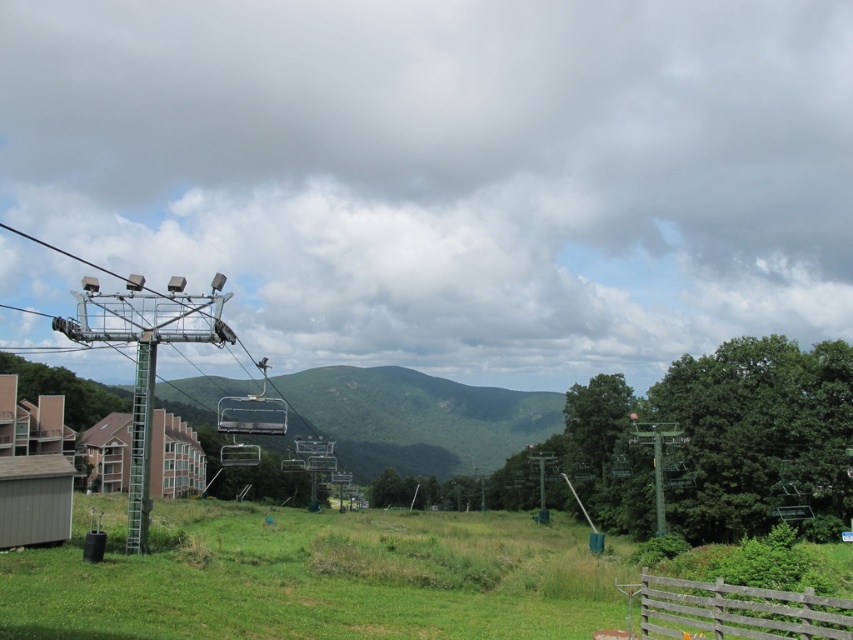
Question: Is wooden fence at lower right to the right of metallic gray chairlift at center from the viewer's perspective?

Choices:
 (A) yes
 (B) no

Answer: (A)

Question: Which point is closer to the camera?

Choices:
 (A) click(44, 579)
 (B) click(132, 547)
 (C) click(689, 604)
 (D) click(231, 458)

Answer: (C)

Question: Which object appears closest to the camera in this image?

Choices:
 (A) metallic gray chairlift at center
 (B) green grassy field at lower center
 (C) wooden fence at lower right

Answer: (C)

Question: Based on their relative distances, which object is farther from the wooden fence at lower right?

Choices:
 (A) green metallic pole at left
 (B) green grassy field at lower center

Answer: (B)

Question: Does wooden fence at lower right appear over green metallic pole at left?

Choices:
 (A) no
 (B) yes

Answer: (A)

Question: Is wooden fence at lower right thinner than metallic gray chairlift at center?

Choices:
 (A) yes
 (B) no

Answer: (A)